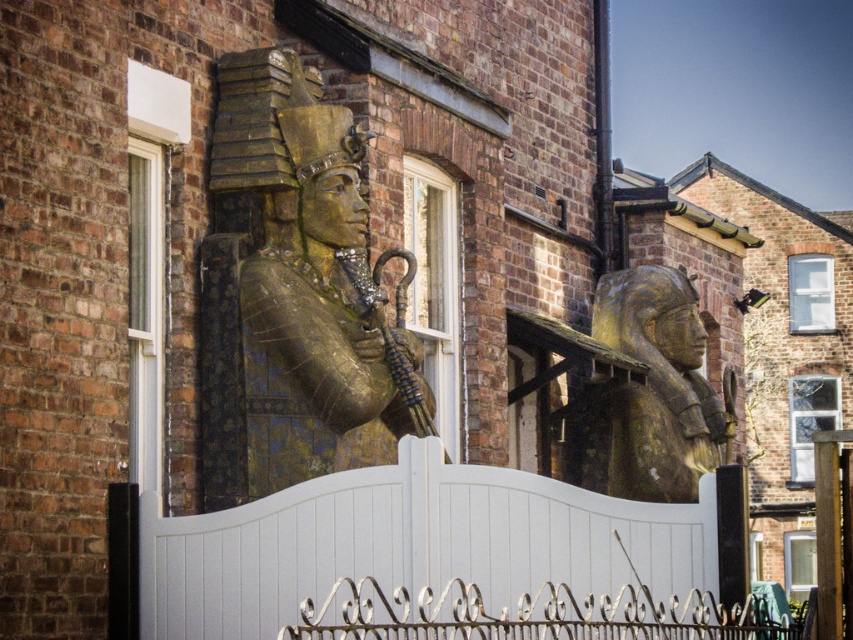
Question: Which point is closer to the camera?

Choices:
 (A) (701, 493)
 (B) (258, 387)

Answer: (A)

Question: From the image, what is the correct spatial relationship of gold/gilded stone pharaoh at center in relation to white painted wood gate at center?

Choices:
 (A) below
 (B) above

Answer: (B)

Question: Can you confirm if gold/gilded stone pharaoh at center is positioned below white painted wood gate at center?

Choices:
 (A) yes
 (B) no

Answer: (B)

Question: In this image, where is white painted wood gate at center located relative to gold/golden stone sphinx at center?

Choices:
 (A) right
 (B) left

Answer: (B)

Question: Which object appears farthest from the camera in this image?

Choices:
 (A) white painted wood gate at center
 (B) gold/gilded stone pharaoh at center
 (C) gold/golden stone sphinx at center

Answer: (C)

Question: Which of the following is the farthest from the observer?

Choices:
 (A) (592, 312)
 (B) (225, 145)

Answer: (A)